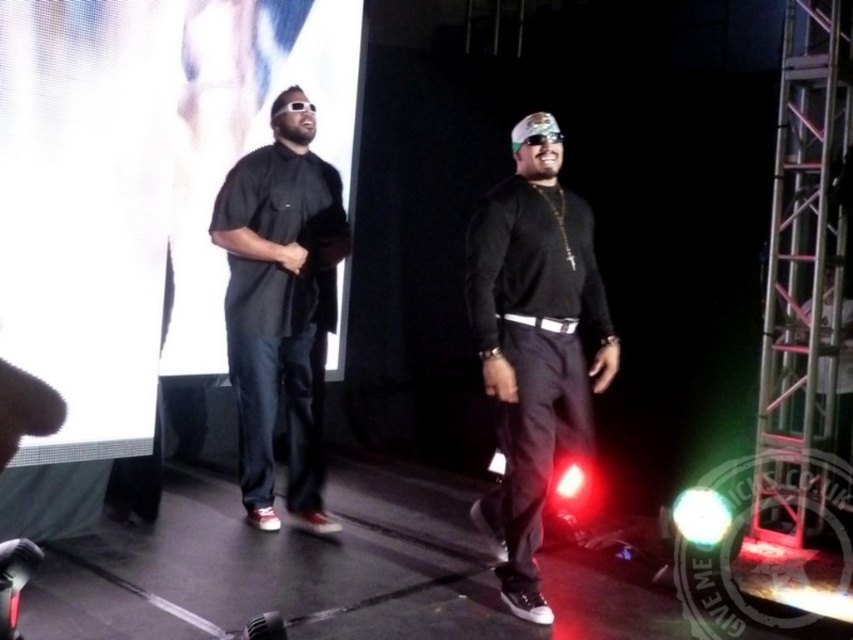
The image size is (853, 640). Describe the element at coordinates (534, 344) in the screenshot. I see `black matte shirt at center` at that location.

Is the position of black matte shirt at center more distant than that of matte black shirt at center?

No.

You are a GUI agent. You are given a task and a screenshot of the screen. Output one action in this format:
    pyautogui.click(x=<x>, y=<y>)
    Task: Click on the black matte shirt at center
    This screenshot has width=853, height=640.
    Given the screenshot: What is the action you would take?
    pyautogui.click(x=534, y=344)